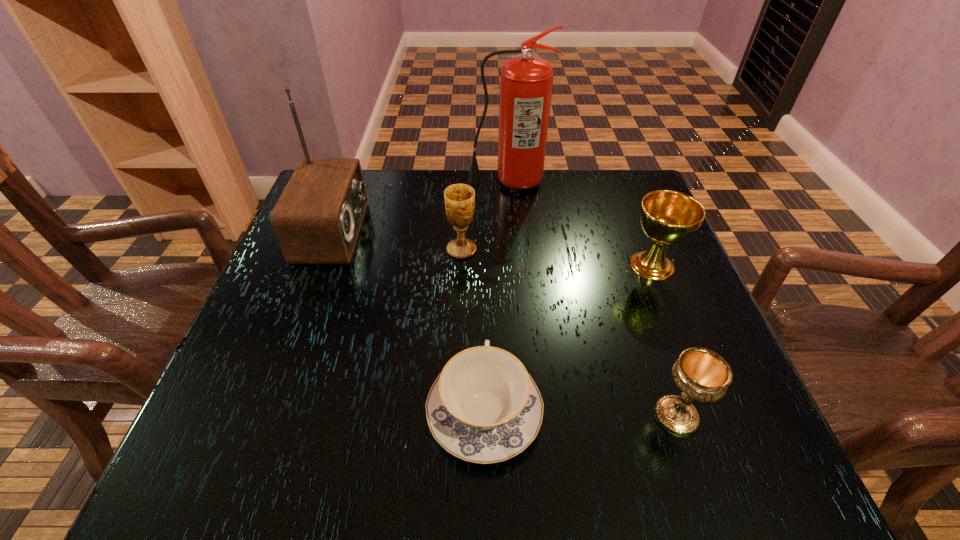
This screenshot has height=540, width=960. What are the coordinates of `empty space between the leftmost object and the nearest chalice` in the screenshot? It's located at (505, 324).

Identify the location of vacant space that's between the fifth shortest object and the leftmost chalice. The image size is (960, 540). (397, 241).

Identify the location of vacant area that lies between the shortest object and the nearest chalice. (580, 414).

This screenshot has height=540, width=960. What are the coordinates of `unoccupied position between the chinaware and the nearest chalice` in the screenshot? It's located at (580, 414).

The height and width of the screenshot is (540, 960). I want to click on free point between the leftmost chalice and the second tallest object, so click(x=397, y=241).

Select which object is the closest to the tallest object. Please provide its 2D coordinates. Your answer should be formatted as a tuple, i.e. [(x, y)], where the tuple contains the x and y coordinates of a point satisfying the conditions above.

[(459, 199)]

Where is `the closest object to the shortest object`? The width and height of the screenshot is (960, 540). the closest object to the shortest object is located at coordinates (701, 374).

Select which chalice is the second closest to the tallest object. Please provide its 2D coordinates. Your answer should be formatted as a tuple, i.e. [(x, y)], where the tuple contains the x and y coordinates of a point satisfying the conditions above.

[(667, 217)]

You are a GUI agent. You are given a task and a screenshot of the screen. Output one action in this format:
    pyautogui.click(x=<x>, y=<y>)
    Task: Click on the chalice that is the second closest to the nearest chalice
    This screenshot has width=960, height=540.
    Given the screenshot: What is the action you would take?
    pyautogui.click(x=459, y=199)

The height and width of the screenshot is (540, 960). What are the coordinates of `vacant space that satisfies the following two spatial constraints: 1. on the front-facing side of the radio receiver; 2. on the left side of the leftmost chalice` in the screenshot? It's located at point(327,249).